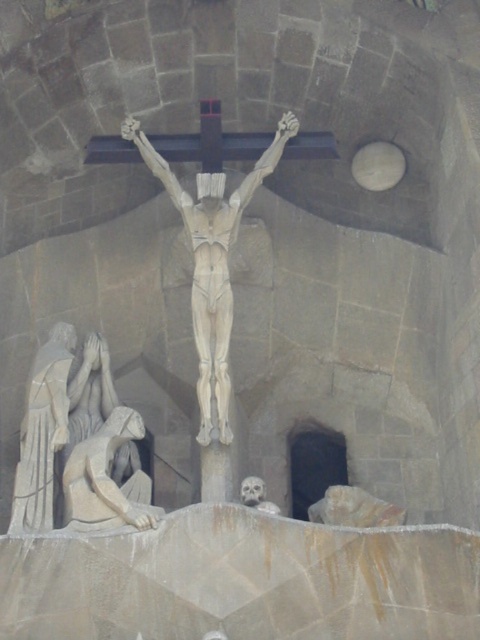
Can you confirm if smooth stone statue at lower left is positioned below smooth gray skull at lower center?

Actually, smooth stone statue at lower left is above smooth gray skull at lower center.

Between smooth stone statue at lower left and smooth gray skull at lower center, which one appears on the left side from the viewer's perspective?

Positioned to the left is smooth stone statue at lower left.

What do you see at coordinates (108, 477) in the screenshot?
I see `smooth stone statue at lower left` at bounding box center [108, 477].

Where is `smooth stone statue at lower left`? This screenshot has height=640, width=480. smooth stone statue at lower left is located at coordinates (108, 477).

Measure the distance between smooth stone crucifix at center and camera.

The distance of smooth stone crucifix at center from camera is 81.16 meters.

Is point (247, 188) positioned after point (126, 442)?

That is True.

Image resolution: width=480 pixels, height=640 pixels. I want to click on smooth stone crucifix at center, so tap(212, 260).

Is point (228, 428) more distant than point (252, 486)?

That is True.

Which is in front, point (194, 273) or point (254, 483)?

Point (254, 483)

Where is `smooth stone crucifix at center`? Image resolution: width=480 pixels, height=640 pixels. smooth stone crucifix at center is located at coordinates (212, 260).

The width and height of the screenshot is (480, 640). I want to click on smooth stone crucifix at center, so click(x=212, y=260).